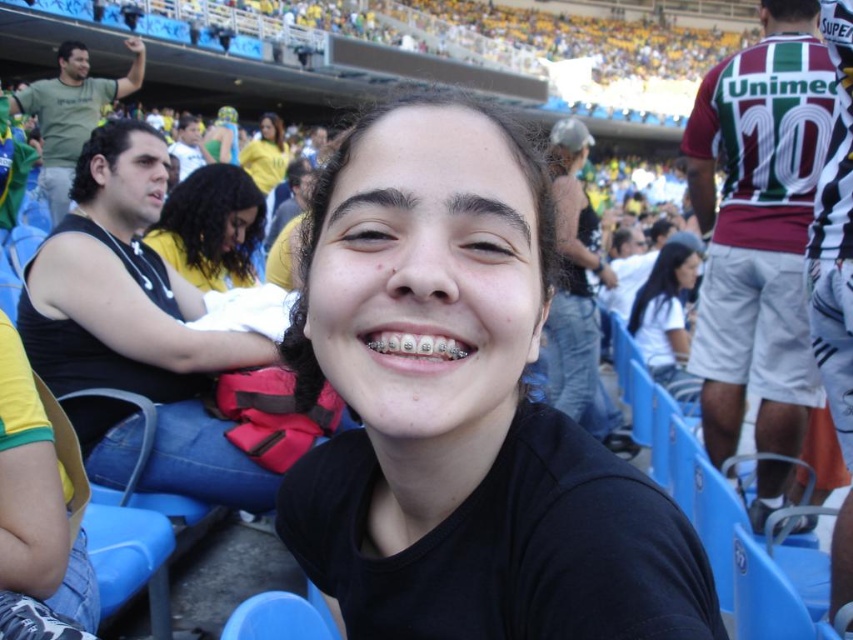
What is the position of the white matte shirt at center in the image?

The white matte shirt at center is located at point (666, 320).

You are a photographer trying to capture a closeup shot of the dark brown hair at center and the yellow jersey at upper center. Which object would you need to zoom in more on to fill the frame, considering their sizes?

The dark brown hair at center has a lesser width compared to the yellow jersey at upper center, so you would need to zoom in more on the dark brown hair at center to fill the frame since it is smaller.

Looking at this image, you are a photographer at the stadium and want to capture a photo where the black matte hair at center and yellow jersey at upper center are both visible. Based on their positions, which object should appear higher in the photo?

The yellow jersey at upper center should appear higher in the photo because it is positioned above the black matte hair at center.